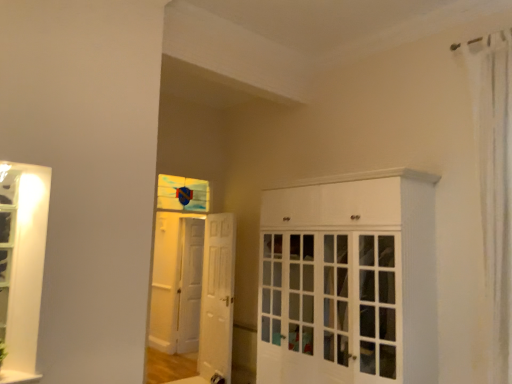
Where is `white glossy window sill at lower left`? The height and width of the screenshot is (384, 512). white glossy window sill at lower left is located at coordinates (18, 377).

What do you see at coordinates (495, 184) in the screenshot? I see `white sheer curtain at right` at bounding box center [495, 184].

Locate an element on the screen. white sheer curtain at right is located at coordinates pyautogui.click(x=495, y=184).

At what (x,y) coordinates should I click in order to perform the action: click on white glossy window sill at lower left. Please return your answer as a coordinate pair (x, y). This screenshot has height=384, width=512. Looking at the image, I should click on pyautogui.click(x=18, y=377).

Is white wooden door at center, the first door from the right, taller than stained glass window at center?

Yes, white wooden door at center, the first door from the right, is taller than stained glass window at center.

Are white wooden door at center, the 2th door viewed from the back, and stained glass window at center far apart?

That's not correct — white wooden door at center, the 2th door viewed from the back, is a little close to stained glass window at center.

From a real-world perspective, does white wooden door at center, the 2th door when ordered from left to right, sit lower than stained glass window at center?

Yes, from a real-world perspective, white wooden door at center, the 2th door when ordered from left to right, is under stained glass window at center.

Is white wooden door at center, the first door from the right, to the left of stained glass window at center from the viewer's perspective?

Incorrect, white wooden door at center, the first door from the right, is not on the left side of stained glass window at center.

At what (x,y) coordinates should I click in order to perform the action: click on window sill below the white glossy door at center, the 1th door when ordered from left to right (from a real-world perspective). Please return your answer as a coordinate pair (x, y). Image resolution: width=512 pixels, height=384 pixels. Looking at the image, I should click on (18, 377).

Which of these two, white glossy window sill at lower left or white glossy door at center, which is counted as the 2th door, starting from the right, is smaller?

white glossy window sill at lower left.

From the image's perspective, between white glossy window sill at lower left and white glossy door at center, which is counted as the 2th door, starting from the right, who is located below?

white glossy door at center, which is counted as the 2th door, starting from the right, appears lower in the image.

Are white glossy window sill at lower left and white glossy door at center, which is counted as the 2th door, starting from the right, located far from each other?

Yes, white glossy window sill at lower left and white glossy door at center, which is counted as the 2th door, starting from the right, are located far from each other.

Which is farther, (371, 367) or (36, 381)?

The point (371, 367) is farther from the camera.

Could you tell me if white glossy cabinet at center is facing white glossy window sill at lower left?

Yes.

Is white glossy cabinet at center far away from white glossy window sill at lower left?

That's right, there is a large distance between white glossy cabinet at center and white glossy window sill at lower left.

Find the location of a particular element. shower curtain behind the white glossy window sill at lower left is located at coordinates (495, 184).

Does white glossy window sill at lower left have a lesser width compared to white sheer curtain at right?

No, white glossy window sill at lower left is not thinner than white sheer curtain at right.

From the image's perspective, is white glossy window sill at lower left above or below white sheer curtain at right?

Clearly, from the image's perspective, white glossy window sill at lower left is below white sheer curtain at right.

Is point (0, 383) closer to viewer compared to point (490, 83)?

Yes, it is in front of point (490, 83).

Are white glossy door at center, the 1th door when ordered from left to right, and white glossy window sill at lower left beside each other?

No, white glossy door at center, the 1th door when ordered from left to right, is not in contact with white glossy window sill at lower left.

From the image's perspective, who appears lower, white glossy door at center, the 1th door when ordered from left to right, or white glossy window sill at lower left?

white glossy door at center, the 1th door when ordered from left to right, from the image's perspective.

Between point (181, 279) and point (22, 379), which one is positioned in front?

Positioned in front is point (22, 379).

Is white glossy door at center, marked as the 1th door in a back-to-front arrangement, further to camera compared to white glossy window sill at lower left?

Yes.

Is white glossy window sill at lower left taller or shorter than white glossy cabinet at center?

white glossy window sill at lower left is shorter than white glossy cabinet at center.

How different are the orientations of white glossy window sill at lower left and white glossy cabinet at center in degrees?

90.4 degrees separate the facing orientations of white glossy window sill at lower left and white glossy cabinet at center.

Is white glossy window sill at lower left not close to white glossy cabinet at center?

Yes.

Which object is more forward, white glossy window sill at lower left or white glossy cabinet at center?

white glossy window sill at lower left is closer to the camera.

Can you confirm if white glossy cabinet at center is positioned to the left of white glossy door at center, marked as the 1th door in a back-to-front arrangement?

Incorrect, white glossy cabinet at center is not on the left side of white glossy door at center, marked as the 1th door in a back-to-front arrangement.

Is point (421, 337) closer or farther from the camera than point (182, 290)?

Point (421, 337).

From the image's perspective, starting from the white glossy cabinet at center, which door is the 2nd one below? Please provide its 2D coordinates.

[(189, 284)]

Is white glossy cabinet at center spatially inside white glossy door at center, which ranks as the 2th door in front-to-back order, or outside of it?

white glossy cabinet at center exists outside the volume of white glossy door at center, which ranks as the 2th door in front-to-back order.

At what (x,y) coordinates should I click in order to perform the action: click on window behind the white wooden door at center, which appears as the 1th door when viewed from the front. Please return your answer as a coordinate pair (x, y). Looking at the image, I should click on (182, 194).

From a real-world perspective, which door is the 1st one above the white glossy window sill at lower left? Please provide its 2D coordinates.

[(189, 284)]

Considering their positions, is white wooden door at center, the 2th door viewed from the back, positioned further to white glossy cabinet at center than white sheer curtain at right?

white wooden door at center, the 2th door viewed from the back, is further to white glossy cabinet at center.

Considering their positions, is white glossy window sill at lower left positioned closer to white glossy cabinet at center than white sheer curtain at right?

white sheer curtain at right is positioned closer to the anchor white glossy cabinet at center.

Based on their spatial positions, is white sheer curtain at right or white glossy door at center, which ranks as the 2th door in front-to-back order, closer to white glossy cabinet at center?

Among the two, white sheer curtain at right is located nearer to white glossy cabinet at center.

When comparing their distances from stained glass window at center, does white glossy door at center, which is counted as the 2th door, starting from the right, or white wooden door at center, the 2th door viewed from the back, seem further?

white wooden door at center, the 2th door viewed from the back, is further to stained glass window at center.

When comparing their distances from white glossy window sill at lower left, does white sheer curtain at right or white wooden door at center, the 2th door when ordered from left to right, seem closer?

white wooden door at center, the 2th door when ordered from left to right.

Consider the image. When comparing their distances from white glossy window sill at lower left, does white sheer curtain at right or stained glass window at center seem closer?

white sheer curtain at right.

Consider the image. Estimate the real-world distances between objects in this image. Which object is closer to white glossy door at center, the 1th door when ordered from left to right, white sheer curtain at right or white wooden door at center, the first door from the right?

A: Based on the image, white wooden door at center, the first door from the right, appears to be nearer to white glossy door at center, the 1th door when ordered from left to right.

Looking at the image, which one is located further to white sheer curtain at right, white glossy door at center, the 1th door when ordered from left to right, or stained glass window at center?

Based on the image, white glossy door at center, the 1th door when ordered from left to right, appears to be further to white sheer curtain at right.

Identify the location of cabinetry between white sheer curtain at right and white glossy door at center, marked as the 1th door in a back-to-front arrangement, along the z-axis. (348, 280).

The width and height of the screenshot is (512, 384). I want to click on door between white sheer curtain at right and white glossy door at center, which is counted as the 2th door, starting from the right, in the front-back direction, so click(x=217, y=298).

At what (x,y) coordinates should I click in order to perform the action: click on door between white glossy cabinet at center and white glossy door at center, which ranks as the 2th door in front-to-back order, from front to back. Please return your answer as a coordinate pair (x, y). Looking at the image, I should click on (217, 298).

The image size is (512, 384). Identify the location of door positioned between white glossy window sill at lower left and stained glass window at center from near to far. coord(217,298).